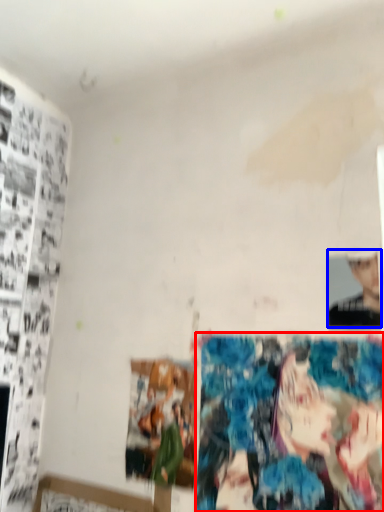
Question: Which object is closer to the camera taking this photo, reflection (highlighted by a red box) or person (highlighted by a blue box)?

Choices:
 (A) reflection
 (B) person

Answer: (A)